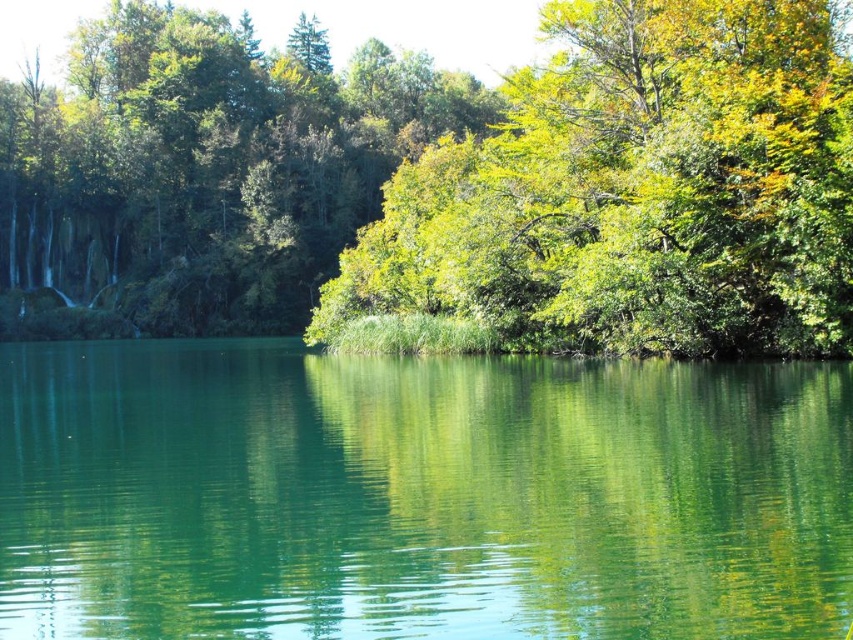
Question: Does green leafy tree at center appear over green smooth water at center?

Choices:
 (A) yes
 (B) no

Answer: (A)

Question: Which point appears farthest from the camera in this image?

Choices:
 (A) (770, 484)
 (B) (94, 88)

Answer: (B)

Question: Which point is farther from the camera taking this photo?

Choices:
 (A) (277, 620)
 (B) (277, 84)

Answer: (B)

Question: Is green leafy tree at center thinner than green smooth water at center?

Choices:
 (A) yes
 (B) no

Answer: (B)

Question: Can you confirm if green leafy tree at center is positioned to the left of green smooth water at center?

Choices:
 (A) yes
 (B) no

Answer: (A)